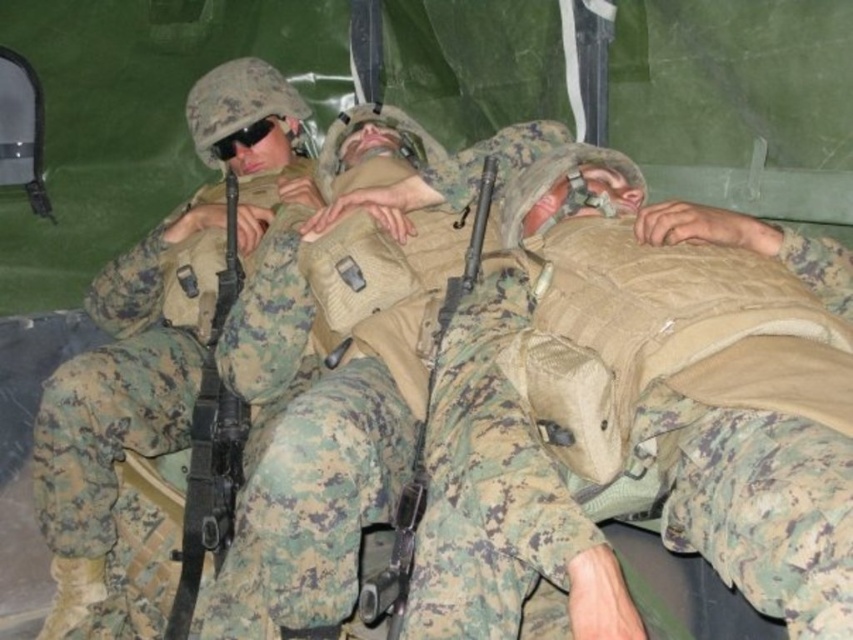
You are a military medic in the field. You need to quickly retrieve the matte black rifle at center and the black matte goggles at upper center. Based on their positions, which object is closer to your current line of sight?

The black matte goggles at upper center are closer to your line of sight because they are positioned above the matte black rifle at center.